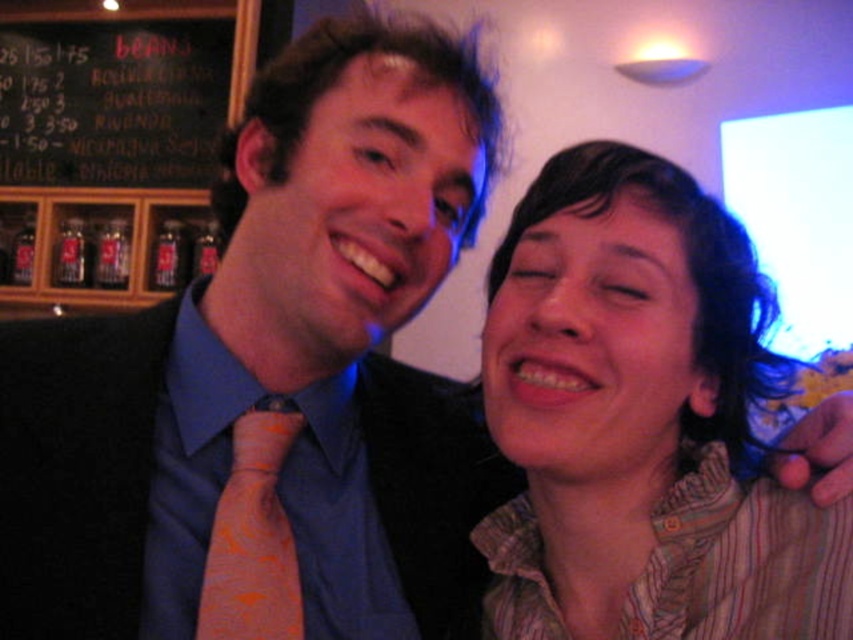
Question: Which of the following is the farthest from the observer?

Choices:
 (A) (289, 566)
 (B) (193, 598)
 (C) (798, 540)
 (D) (140, 28)

Answer: (D)

Question: Is black chalkboard at upper left below orange patterned tie at center?

Choices:
 (A) no
 (B) yes

Answer: (A)

Question: Can you confirm if black chalkboard at upper left is bigger than orange patterned tie at center?

Choices:
 (A) no
 (B) yes

Answer: (B)

Question: Which of the following is the closest to the observer?

Choices:
 (A) orange patterned tie at center
 (B) orange silk dress shirt at left
 (C) black chalkboard at upper left
 (D) striped cotton shirt at right

Answer: (D)

Question: Where is black chalkboard at upper left located in relation to orange patterned tie at center in the image?

Choices:
 (A) above
 (B) below

Answer: (A)

Question: Estimate the real-world distances between objects in this image. Which object is farther from the striped cotton shirt at right?

Choices:
 (A) black chalkboard at upper left
 (B) orange patterned tie at center
 (C) orange silk dress shirt at left

Answer: (A)